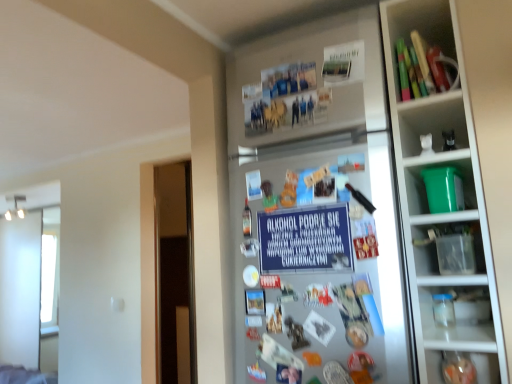
Question: Is silver metallic fridge at center to the left or to the right of wooden blocks at upper right, positioned as the first shelf in top-to-bottom order, in the image?

Choices:
 (A) right
 (B) left

Answer: (B)

Question: Is silver metallic fridge at center wider or thinner than wooden blocks at upper right, positioned as the first shelf in top-to-bottom order?

Choices:
 (A) wide
 (B) thin

Answer: (B)

Question: Which is farther from the silver metallic fridge at center?

Choices:
 (A) green plastic bucket at right, which is counted as the 2th shelf, starting from the top
 (B) wooden blocks at upper right, which is counted as the second shelf, starting from the bottom
 (C) blue paper sign at center

Answer: (B)

Question: Estimate the real-world distances between objects in this image. Which object is closer to the silver metallic fridge at center?

Choices:
 (A) blue paper sign at center
 (B) green plastic bucket at right, which is counted as the 2th shelf, starting from the top
 (C) wooden blocks at upper right, positioned as the first shelf in top-to-bottom order

Answer: (A)